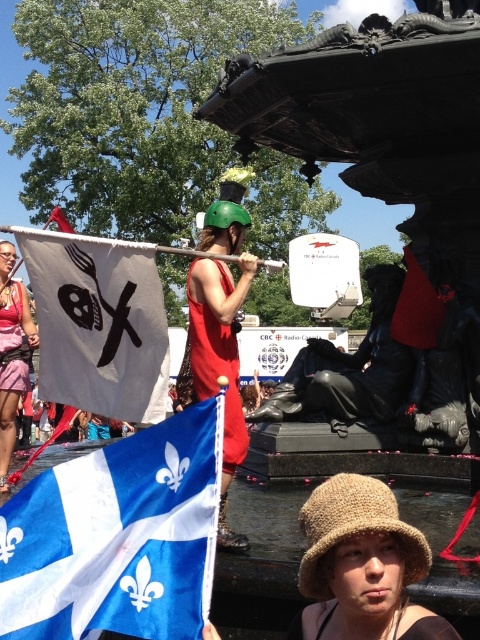
Question: Which object is farther from the camera taking this photo?

Choices:
 (A) brown knitted hat at center
 (B) white fabric flag at center

Answer: (B)

Question: Which point appears closest to the camera in this image?

Choices:
 (A) (14, 288)
 (B) (159, 582)
 (C) (196, 349)

Answer: (B)

Question: Does brown knitted hat at center come behind matte red tank top at center?

Choices:
 (A) yes
 (B) no

Answer: (B)

Question: Is blue fabric flag at lower left smaller than white fabric flag at center?

Choices:
 (A) yes
 (B) no

Answer: (A)

Question: In this image, where is white fabric flag at center located relative to matte red tank top at center?

Choices:
 (A) below
 (B) above

Answer: (B)

Question: Among these objects, which one is nearest to the camera?

Choices:
 (A) leather jacket at center
 (B) brown knitted hat at center
 (C) pink fabric dress at left
 (D) matte red tank top at center

Answer: (B)